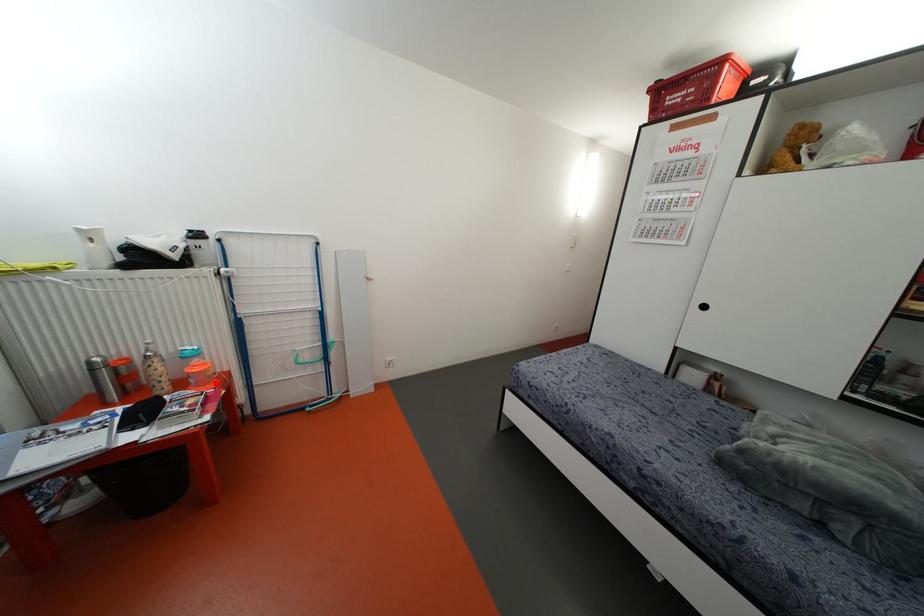
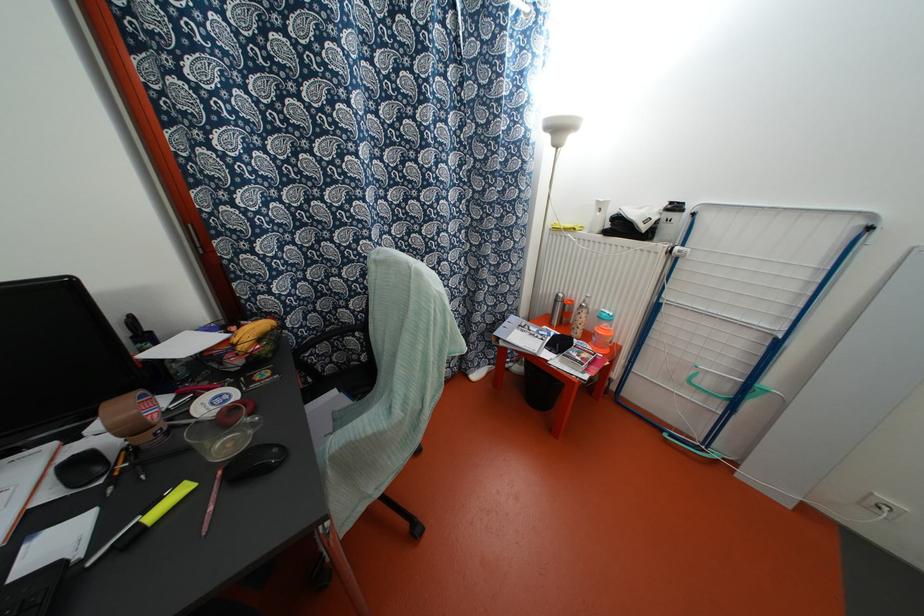
In the second image, find the point that corresponds to the highlighted location in the first image.

(606, 351)